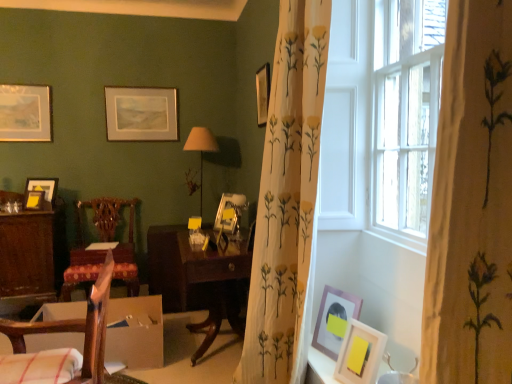
Question: Considering the positions of matte gold picture frame at left, the fourth picture frame from the back, and wooden chair at left, positioned as the 1th chair in right-to-left order, in the image, is matte gold picture frame at left, the fourth picture frame from the back, wider or thinner than wooden chair at left, positioned as the 1th chair in right-to-left order,?

Choices:
 (A) thin
 (B) wide

Answer: (A)

Question: Is point (34, 208) closer or farther from the camera than point (91, 317)?

Choices:
 (A) closer
 (B) farther

Answer: (B)

Question: Estimate the real-world distances between objects in this image. Which object is farther from the matte silver picture frame at upper left, arranged as the seventh picture frame when viewed from the front?

Choices:
 (A) dark wood table at center
 (B) wooden drawer at center
 (C) matte gold picture frame at center, arranged as the 5th picture frame when viewed from the left
 (D) matte gold picture frame at left, the fourth picture frame from the back
 (E) matte gold picture frame at upper center, the 5th picture frame from the right

Answer: (C)

Question: Estimate the real-world distances between objects in this image. Which object is farther from the matte gold picture frame at center, arranged as the 5th picture frame when viewed from the left?

Choices:
 (A) matte brown picture frame at lower right, which is the second picture frame in right-to-left order
 (B) wooden carved chair at left, the 2th chair from the right
 (C) matte black picture frame at left, positioned as the 6th picture frame in front-to-back order
 (D) cardboard box at lower left
 (E) matte gold picture frame at left, the fourth picture frame from the back

Answer: (E)